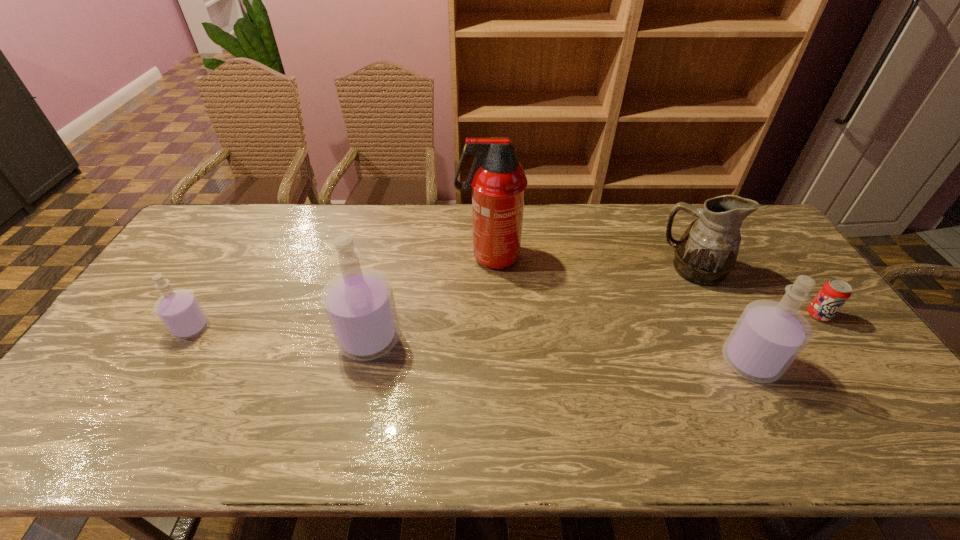
At what (x,y) coordinates should I click in order to perform the action: click on object present at the left edge. Please return your answer as a coordinate pair (x, y). Looking at the image, I should click on (179, 310).

The width and height of the screenshot is (960, 540). What are the coordinates of `object that is at the right edge` in the screenshot? It's located at (834, 293).

Image resolution: width=960 pixels, height=540 pixels. In order to click on blank space at the far edge of the desktop in this screenshot , I will do `click(370, 227)`.

You are a GUI agent. You are given a task and a screenshot of the screen. Output one action in this format:
    pyautogui.click(x=<x>, y=<y>)
    Task: Click on the vacant space at the near edge of the desktop
    Image resolution: width=960 pixels, height=540 pixels.
    Given the screenshot: What is the action you would take?
    pyautogui.click(x=236, y=381)

The width and height of the screenshot is (960, 540). Identify the location of free space at the right edge of the desktop. (762, 265).

The image size is (960, 540). What are the coordinates of `vacant space at the near right corner of the desktop` in the screenshot? It's located at (870, 403).

What are the coordinates of `empty space that is in between the rightmost perfume and the pitcher` in the screenshot? It's located at (722, 315).

You are a GUI agent. You are given a task and a screenshot of the screen. Output one action in this format:
    pyautogui.click(x=<x>, y=<y>)
    Task: Click on the free space between the fifth tallest object and the shortest object
    
    Given the screenshot: What is the action you would take?
    pyautogui.click(x=505, y=321)

You are a GUI agent. You are given a task and a screenshot of the screen. Output one action in this format:
    pyautogui.click(x=<x>, y=<y>)
    Task: Click on the empty space between the rightmost object and the fifth tallest object
    
    Given the screenshot: What is the action you would take?
    pyautogui.click(x=505, y=321)

This screenshot has height=540, width=960. Identify the location of free space between the leftmost object and the pitcher. (444, 298).